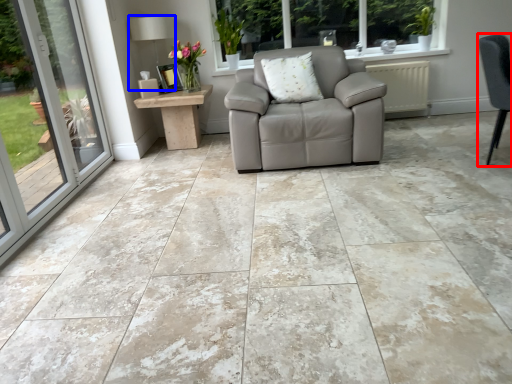
Question: Which object appears farthest to the camera in this image, chair (highlighted by a red box) or lamp (highlighted by a blue box)?

Choices:
 (A) chair
 (B) lamp

Answer: (B)